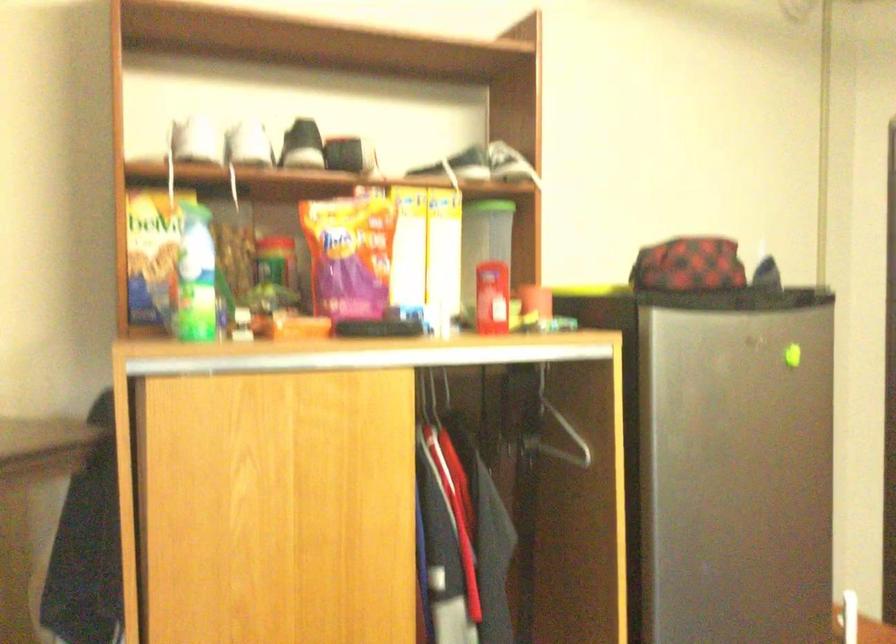
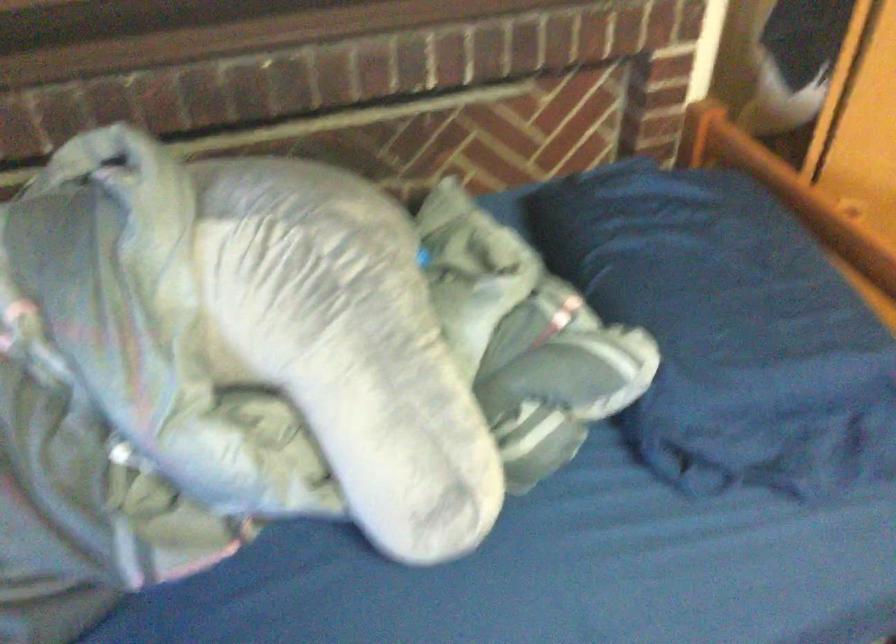
Based on the continuous images, in which direction is the camera rotating?

The camera's rotation is toward left-down.